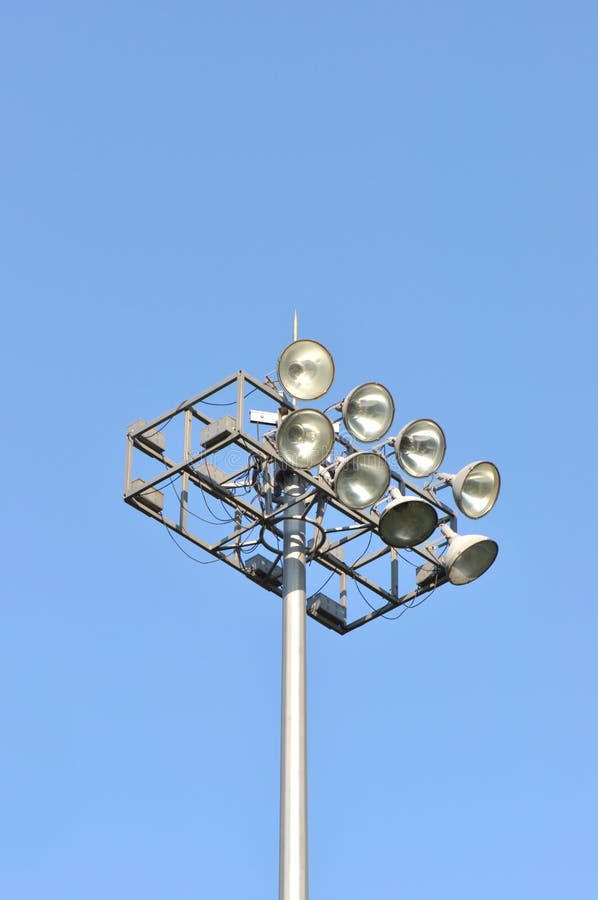
This screenshot has width=598, height=900. I want to click on lights, so click(302, 437), click(365, 474), click(402, 520), click(472, 552), click(472, 482), click(417, 450), click(353, 411), click(301, 371).